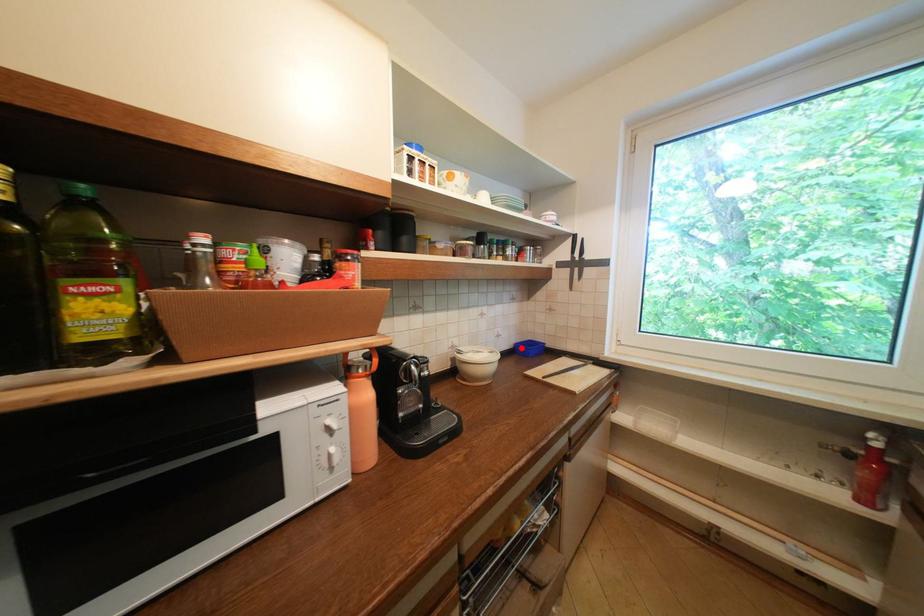
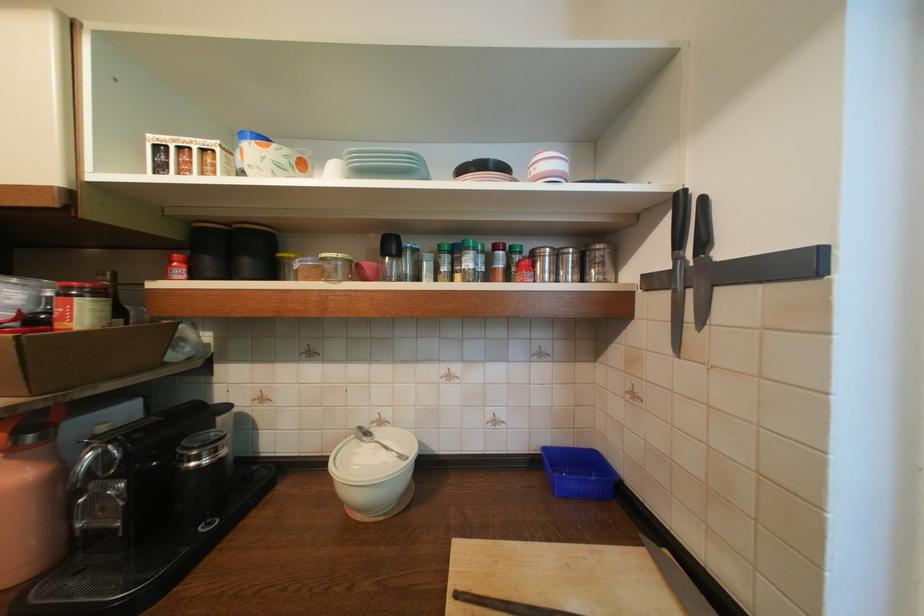
The point at the highlighted location is marked in the first image. Where is the corresponding point in the second image?

(550, 454)